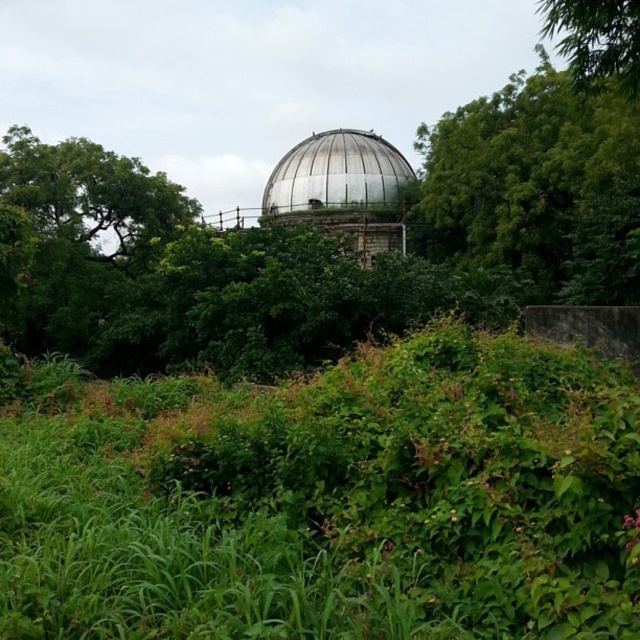
Based on the scene description, which object takes up more area in the image between the green leafy grass at center and the green leafy tree at upper center?

The green leafy tree at upper center occupies more area than the green leafy grass at center.

You are standing in the outdoor scene and want to place a small garden ornament exactly at the center of the image. Given the green leafy grass at center is located at point 0.781, 0.516, is this position suitable for placing the ornament to ensure it is centered?

The green leafy grass at center is located at point (330, 499), which indicates it is not exactly at the center of the image. The exact center would be at coordinates (320, 320). Therefore, placing the ornament at the green leafy grass at center would not center it in the image.

You are standing in the outdoor scene and want to walk from the green leafy grass at center to the green leafy tree at upper center. Which direction should you move to reach the tree?

To reach the green leafy tree at upper center from the green leafy grass at center, you should move to the right since the grass is located to the left of the tree.